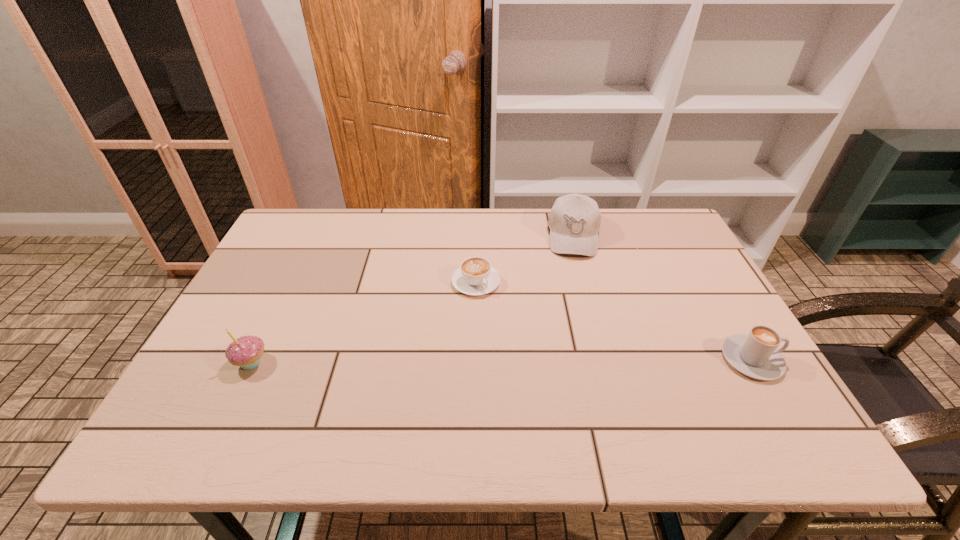
The image size is (960, 540). What are the coordinates of `the leftmost object` in the screenshot? It's located at (246, 351).

This screenshot has height=540, width=960. What are the coordinates of `the nearer cappuccino` in the screenshot? It's located at (755, 355).

You are a GUI agent. You are given a task and a screenshot of the screen. Output one action in this format:
    pyautogui.click(x=<x>, y=<y>)
    Task: Click on the right cappuccino
    
    Given the screenshot: What is the action you would take?
    pyautogui.click(x=755, y=355)

In order to click on the farther cappuccino in this screenshot , I will do `click(475, 276)`.

Where is `the shortest object`? the shortest object is located at coordinates (475, 276).

Find the location of a particular element. the farthest object is located at coordinates (574, 221).

The image size is (960, 540). Identify the location of the third object from left to right. tap(574, 221).

The width and height of the screenshot is (960, 540). In order to click on vacant space located 0.120m on the back of the cupcake in this screenshot , I will do `click(276, 313)`.

This screenshot has height=540, width=960. Identify the location of vacant space located on the side of the left cappuccino with the handle. (542, 369).

Where is `free space located on the side of the left cappuccino with the handle`? free space located on the side of the left cappuccino with the handle is located at coordinates tap(552, 382).